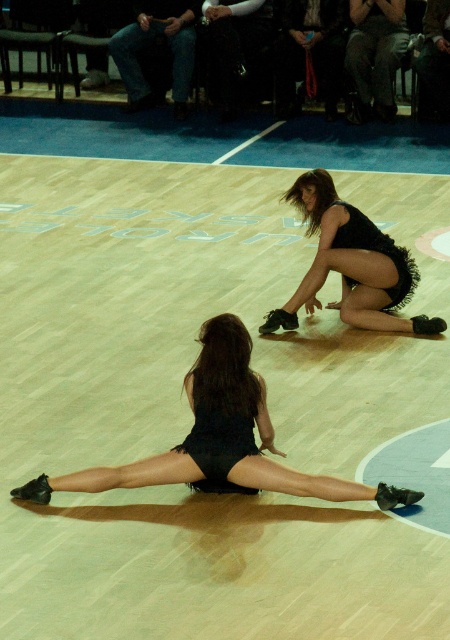
Based on the photo, you are a photographer standing at the entrance of the gymnasium. You need to take a photo of the black sequined dress at lower center. According to the coordinates provided, where should you position your camera to capture it best?

The black sequined dress at lower center is located at point (217, 444). To capture it best, position the camera at that coordinate.